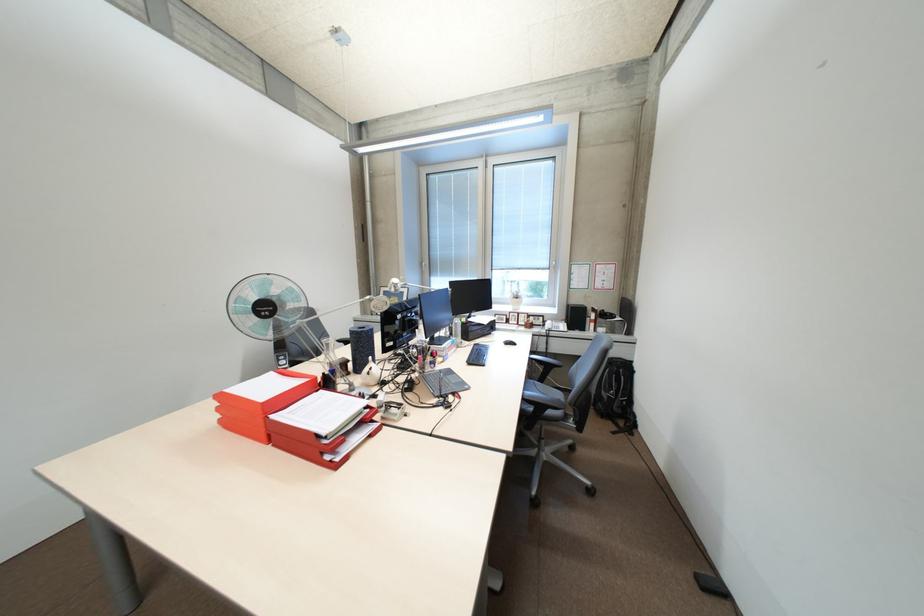
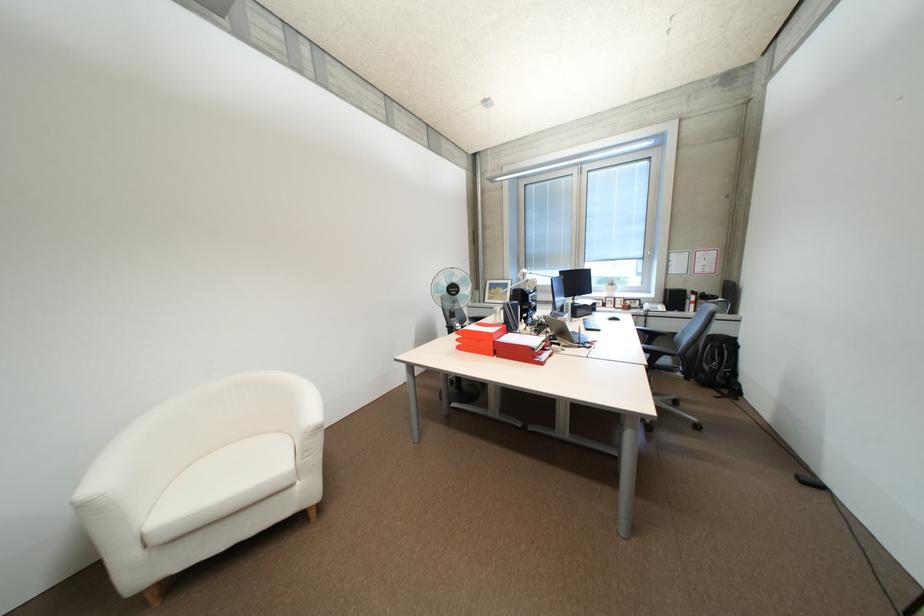
What movement of the cameraman would produce the second image?

The movement direction of the cameraman is left, backward.